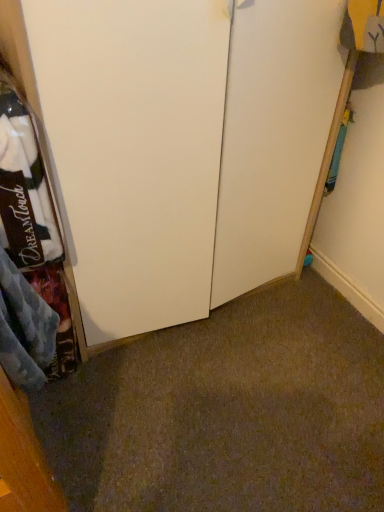
The height and width of the screenshot is (512, 384). Describe the element at coordinates (33, 221) in the screenshot. I see `white soft towel at left` at that location.

Find the location of a particular element. white soft towel at left is located at coordinates (33, 221).

The image size is (384, 512). In order to click on white soft towel at left in this screenshot , I will do `click(33, 221)`.